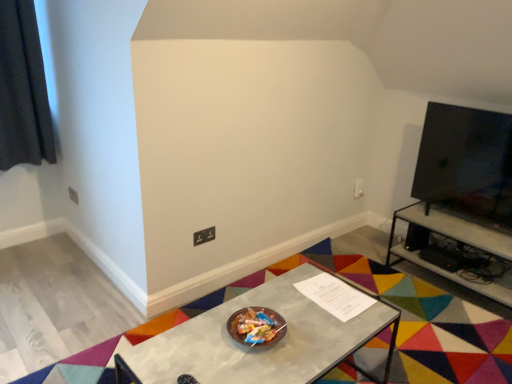
Question: Is metallic gray table at right, the 1th table viewed from the right, oriented away from black fabric curtain at upper left?

Choices:
 (A) no
 (B) yes

Answer: (A)

Question: Considering the relative sizes of metallic gray table at right, the 1th table viewed from the right, and black fabric curtain at upper left in the image provided, is metallic gray table at right, the 1th table viewed from the right, taller than black fabric curtain at upper left?

Choices:
 (A) yes
 (B) no

Answer: (B)

Question: Does metallic gray table at right, the second table when ordered from left to right, appear on the right side of black fabric curtain at upper left?

Choices:
 (A) no
 (B) yes

Answer: (B)

Question: Is metallic gray table at right, the second table when ordered from left to right, smaller than black fabric curtain at upper left?

Choices:
 (A) no
 (B) yes

Answer: (A)

Question: Considering the relative positions of metallic gray table at right, arranged as the 1th table when viewed from the back, and black fabric curtain at upper left in the image provided, is metallic gray table at right, arranged as the 1th table when viewed from the back, in front of black fabric curtain at upper left?

Choices:
 (A) no
 (B) yes

Answer: (B)

Question: Is matte black power outlet at lower center bigger or smaller than black fabric curtain at upper left?

Choices:
 (A) big
 (B) small

Answer: (B)

Question: Is matte black power outlet at lower center in front of or behind black fabric curtain at upper left in the image?

Choices:
 (A) front
 (B) behind

Answer: (B)

Question: Is point (193, 236) closer or farther from the camera than point (12, 147)?

Choices:
 (A) farther
 (B) closer

Answer: (B)

Question: Looking at their shapes, would you say matte black power outlet at lower center is wider or thinner than black fabric curtain at upper left?

Choices:
 (A) thin
 (B) wide

Answer: (A)

Question: Based on their positions, is matte black power outlet at lower center located to the left or right of metallic gray table at center, marked as the 1th table in a front-to-back arrangement?

Choices:
 (A) left
 (B) right

Answer: (A)

Question: Is point (202, 240) positioned closer to the camera than point (267, 292)?

Choices:
 (A) closer
 (B) farther

Answer: (B)

Question: From their relative heights in the image, would you say matte black power outlet at lower center is taller or shorter than metallic gray table at center, which is the second table in right-to-left order?

Choices:
 (A) tall
 (B) short

Answer: (B)

Question: Which is correct: matte black power outlet at lower center is inside metallic gray table at center, which is the second table in right-to-left order, or outside of it?

Choices:
 (A) inside
 (B) outside

Answer: (B)

Question: Is point (188, 331) closer or farther from the camera than point (205, 230)?

Choices:
 (A) closer
 (B) farther

Answer: (A)

Question: From a real-world perspective, relative to matte black power outlet at lower center, is metallic gray table at center, arranged as the 2th table when viewed from the back, vertically above or below?

Choices:
 (A) below
 (B) above

Answer: (A)